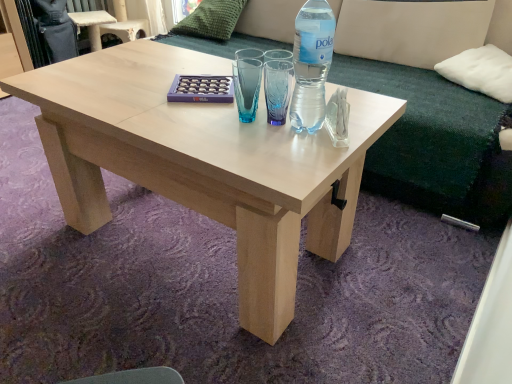
Question: Is clear plastic bottle at center positioned behind green textured pillow at upper center, acting as the 1th pillow starting from the left?

Choices:
 (A) no
 (B) yes

Answer: (A)

Question: Can you confirm if clear plastic bottle at center is bigger than green textured pillow at upper center, acting as the 1th pillow starting from the left?

Choices:
 (A) no
 (B) yes

Answer: (A)

Question: Does clear plastic bottle at center appear on the right side of green textured pillow at upper center, the 1th pillow positioned from the back?

Choices:
 (A) yes
 (B) no

Answer: (A)

Question: Is clear plastic bottle at center thinner than green textured pillow at upper center, the 2th pillow in the bottom-to-top sequence?

Choices:
 (A) yes
 (B) no

Answer: (A)

Question: Can you confirm if clear plastic bottle at center is wider than green textured pillow at upper center, the second pillow positioned from the front?

Choices:
 (A) no
 (B) yes

Answer: (A)

Question: From the image's perspective, is clear plastic bottle at center located beneath green textured pillow at upper center, the 2th pillow in the bottom-to-top sequence?

Choices:
 (A) no
 (B) yes

Answer: (B)

Question: Is beige fabric couch at upper center taller than white soft cushion at upper right, the first pillow positioned from the front?

Choices:
 (A) no
 (B) yes

Answer: (B)

Question: From the image's perspective, would you say beige fabric couch at upper center is shown under white soft cushion at upper right, the first pillow positioned from the front?

Choices:
 (A) no
 (B) yes

Answer: (A)

Question: Is beige fabric couch at upper center located outside white soft cushion at upper right, which ranks as the second pillow in back-to-front order?

Choices:
 (A) yes
 (B) no

Answer: (A)

Question: From the image's perspective, is beige fabric couch at upper center above white soft cushion at upper right, the 2th pillow positioned from the top?

Choices:
 (A) yes
 (B) no

Answer: (A)

Question: Is beige fabric couch at upper center turned away from white soft cushion at upper right, which appears as the 1th pillow when viewed from the right?

Choices:
 (A) no
 (B) yes

Answer: (B)

Question: Are beige fabric couch at upper center and white soft cushion at upper right, which is the 2th pillow in left-to-right order, making contact?

Choices:
 (A) no
 (B) yes

Answer: (A)

Question: Can you confirm if natural wood coffee table at center is shorter than green textured pillow at upper center, the 1th pillow in the top-to-bottom sequence?

Choices:
 (A) no
 (B) yes

Answer: (B)